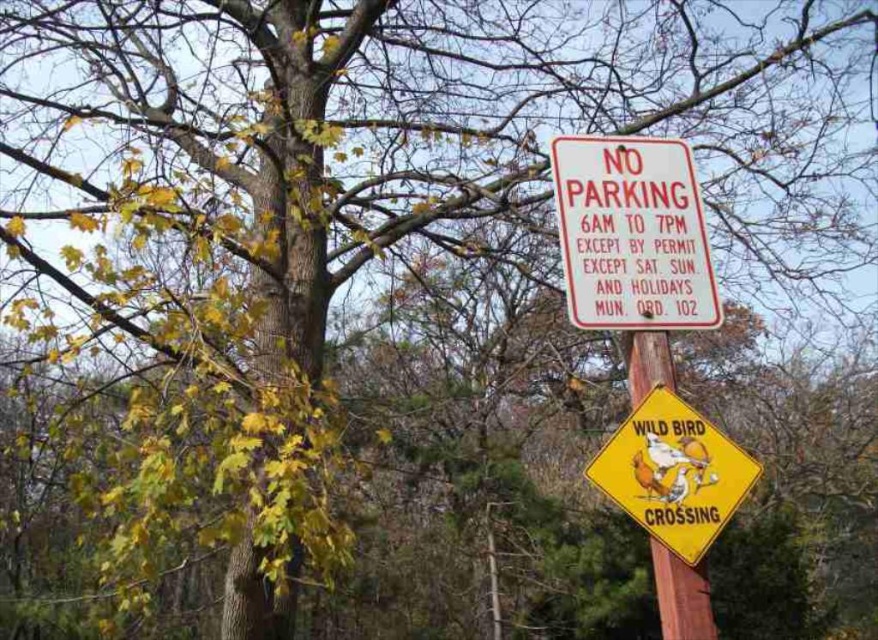
Question: Estimate the real-world distances between objects in this image. Which object is closer to the yellow diamond-shaped sign at center-right?

Choices:
 (A) wooden post at center
 (B) white paper sign at upper center

Answer: (A)

Question: Which point is closer to the camera taking this photo?

Choices:
 (A) (632, 515)
 (B) (581, 163)
 (C) (673, 634)

Answer: (C)

Question: Observing the image, what is the correct spatial positioning of yellow diamond-shaped sign at center-right in reference to wooden post at center?

Choices:
 (A) above
 (B) below

Answer: (A)

Question: Is yellow diamond-shaped sign at center-right to the left of wooden post at center from the viewer's perspective?

Choices:
 (A) yes
 (B) no

Answer: (A)

Question: Which object is closer to the camera taking this photo?

Choices:
 (A) white paper sign at upper center
 (B) yellow diamond-shaped sign at center-right

Answer: (B)

Question: Can you confirm if yellow diamond-shaped sign at center-right is positioned to the left of wooden post at center?

Choices:
 (A) no
 (B) yes

Answer: (B)